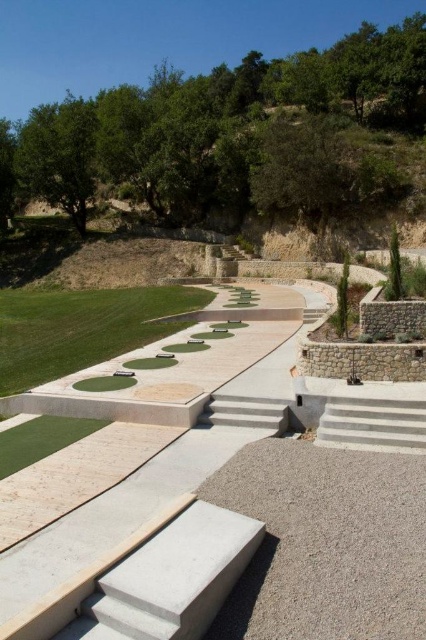
Question: From the image, what is the correct spatial relationship of gray concrete at center in relation to green artificial turf at lower left?

Choices:
 (A) below
 (B) above

Answer: (A)

Question: Does green smooth lawn at lower left have a greater width compared to concrete stairs at center?

Choices:
 (A) no
 (B) yes

Answer: (B)

Question: Which point is farther to the camera?

Choices:
 (A) (287, 428)
 (B) (385, 419)
 (C) (40, 374)
 (D) (54, 422)

Answer: (C)

Question: Based on their relative distances, which object is farther from the gray concrete at center?

Choices:
 (A) green smooth lawn at lower left
 (B) white concrete stairs at lower right

Answer: (A)

Question: Which object is farther from the camera taking this photo?

Choices:
 (A) white concrete stairs at lower right
 (B) gray concrete at center
 (C) green smooth lawn at lower left
 (D) green artificial turf at lower left

Answer: (C)

Question: Does gray concrete at center appear over concrete stairs at center?

Choices:
 (A) no
 (B) yes

Answer: (A)